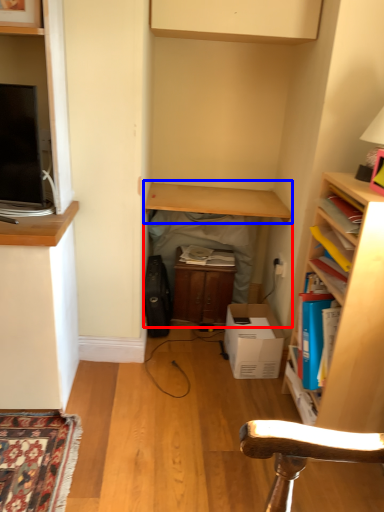
Question: Which point is closer to the camera, table (highlighted by a red box) or table (highlighted by a blue box)?

Choices:
 (A) table
 (B) table

Answer: (B)